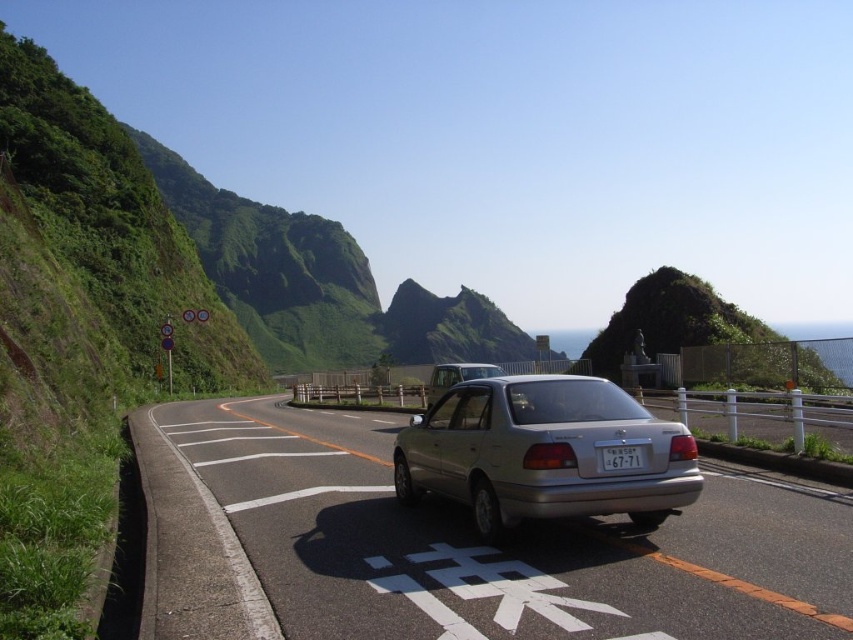
You are a driver who wants to park your car on the side of the road. You see a silver metallic car at center and a white plastic license plate at center. Which object is taller?

The silver metallic car at center is taller than the white plastic license plate at center.

You are driving a car and need to park on the scenic road shown. The road has a metal railing on the right and a steep hillside on the left. You see a satin silver sedan at center and a white plastic license plate at center. Which object is taller?

The satin silver sedan at center is taller than the white plastic license plate at center.